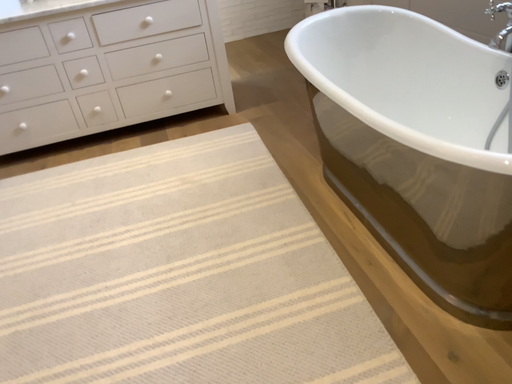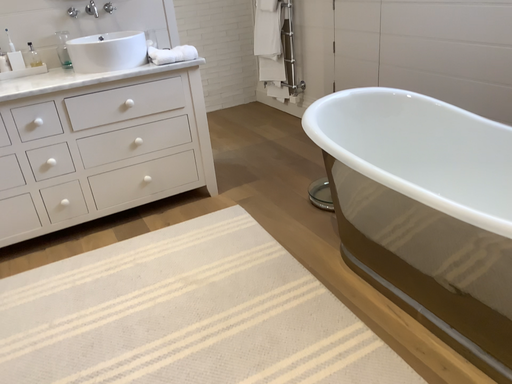
Question: Which way did the camera rotate in the video?

Choices:
 (A) rotated right
 (B) rotated left

Answer: (A)